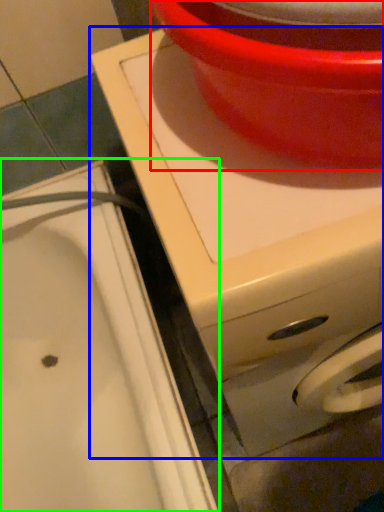
Question: Considering the real-world distances, which object is closest to basin (highlighted by a red box)? appliance (highlighted by a blue box) or sink (highlighted by a green box).

Choices:
 (A) appliance
 (B) sink

Answer: (A)